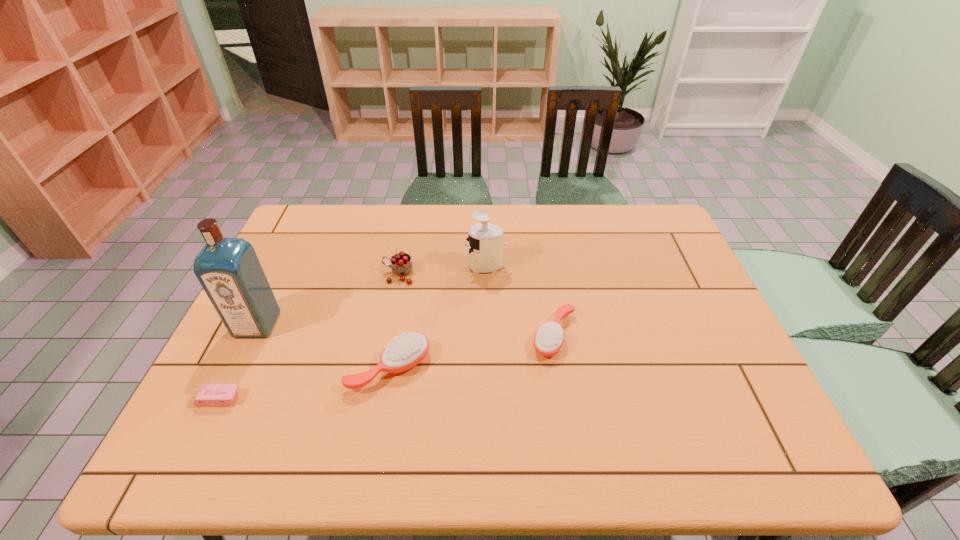
The image size is (960, 540). Find the location of `free point that keeps the hairbrushs evenly spaced on the right`. free point that keeps the hairbrushs evenly spaced on the right is located at coordinates (700, 308).